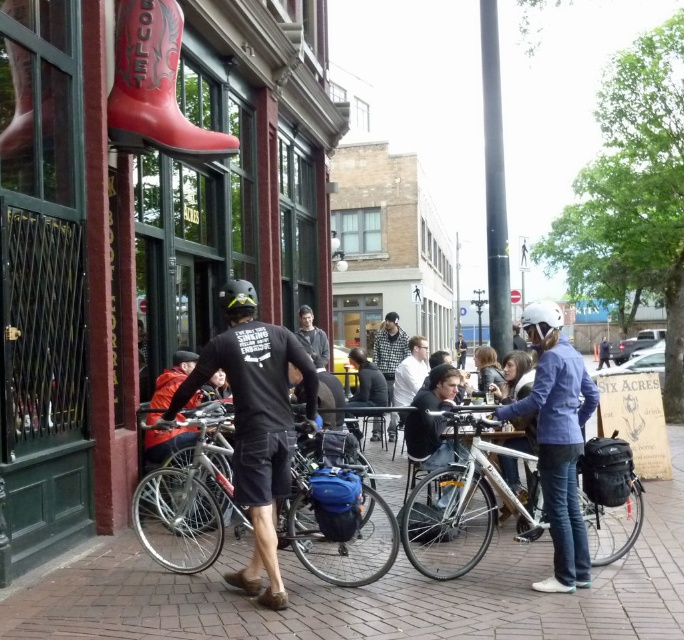
You are a delivery person who needs to pick up a package from the BOOT CORRAL store. You see the silver metallic bicycle at center and the white matte bicycle helmet at center. Which object is closer to the ground?

The silver metallic bicycle at center is below the white matte bicycle helmet at center, so it is closer to the ground.

You are a pedestrian walking on the sidewalk and see the white matte shirt at center and the white matte bicycle helmet at center. Which object is closer to you?

The white matte shirt at center is closer to you because the white matte bicycle helmet at center is behind it.